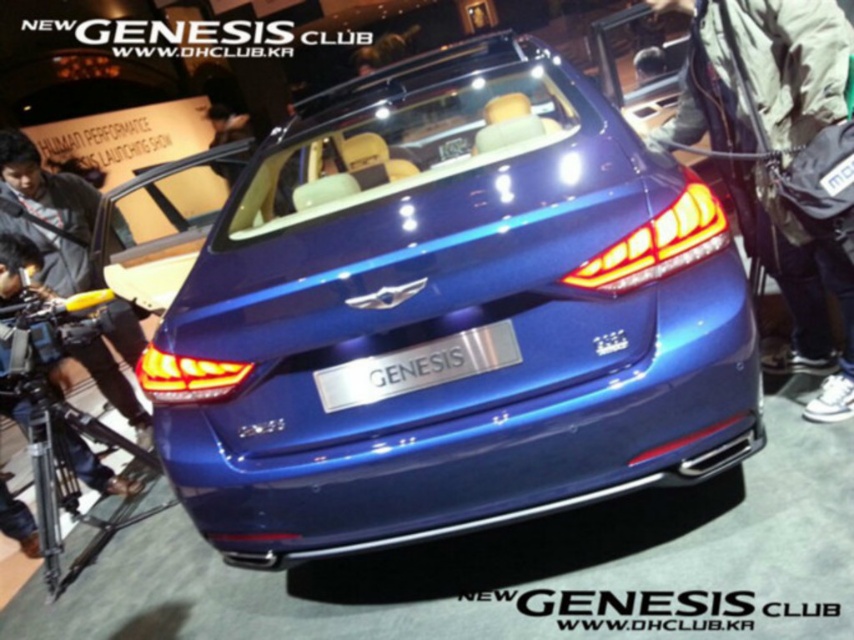
The height and width of the screenshot is (640, 854). Identify the location of dark blue leather jacket at left. click(x=48, y=212).

Between point (139, 433) and point (492, 364), which one is positioned behind?

The point (139, 433) is more distant.

Is point (21, 195) more distant than point (393, 356)?

That is True.

You are a GUI agent. You are given a task and a screenshot of the screen. Output one action in this format:
    pyautogui.click(x=<x>, y=<y>)
    Task: Click on the dark blue leather jacket at left
    
    Given the screenshot: What is the action you would take?
    pyautogui.click(x=48, y=212)

Based on the photo, is metallic blue car at center behind dark blue leather jacket at right?

No, it is not.

Who is higher up, metallic blue car at center or dark blue leather jacket at right?

dark blue leather jacket at right is higher up.

Who is more forward, (314, 164) or (850, 388)?

Positioned in front is point (850, 388).

The image size is (854, 640). I want to click on metallic blue car at center, so click(449, 316).

Between metallic blue car at center and dark blue leather jacket at left, which one is positioned lower?

metallic blue car at center

Is point (404, 180) less distant than point (113, 317)?

Yes, point (404, 180) is closer to viewer.

Where is `metallic blue car at center`? The width and height of the screenshot is (854, 640). metallic blue car at center is located at coordinates (449, 316).